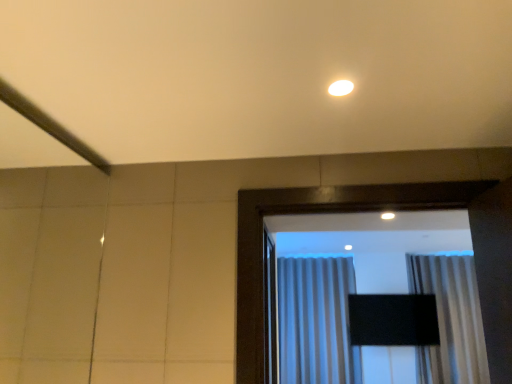
Question: In the image, is silky white curtain at center, which is the 2th curtain in left-to-right order, on the left side or the right side of white glossy light fixture at upper center?

Choices:
 (A) right
 (B) left

Answer: (A)

Question: Considering their positions, is silky white curtain at center, the 1th curtain from the right, located in front of or behind white glossy light fixture at upper center?

Choices:
 (A) behind
 (B) front

Answer: (A)

Question: Based on their relative distances, which object is nearer to the gray textured curtain at center, placed as the second curtain when sorted from right to left?

Choices:
 (A) white glossy light fixture at upper center
 (B) silky white curtain at center, the 1th curtain from the right

Answer: (B)

Question: Estimate the real-world distances between objects in this image. Which object is closer to the white glossy light fixture at upper center?

Choices:
 (A) gray textured curtain at center, placed as the second curtain when sorted from right to left
 (B) silky white curtain at center, the 1th curtain from the right

Answer: (B)